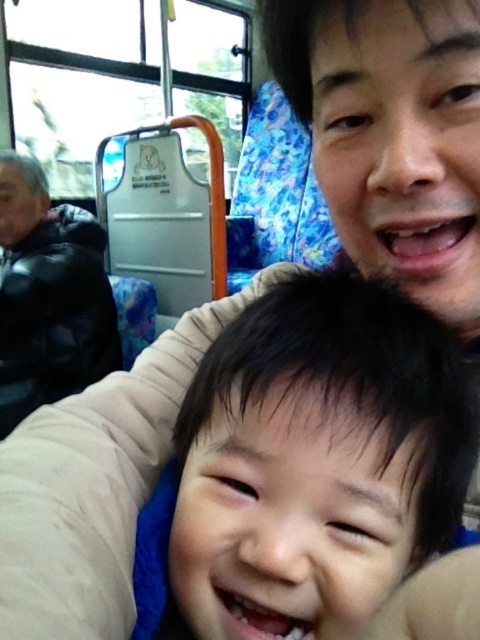
You are a photographer trying to capture the black matte hair at center and the black fuzzy jacket at left in the same frame. Based on their positions, which object should you adjust your camera to focus on first to ensure both are in the shot?

Since the black matte hair at center is to the right of the black fuzzy jacket at left, you should focus on the black fuzzy jacket at left first to ensure both are included in the frame.

You are a passenger on a bus and want to know if the black matte hair at center is above or below the black fuzzy jacket at left. Based on the scene description, what is the relationship between their positions?

The black matte hair at center is located below the black fuzzy jacket at left, so it is positioned underneath it.

Looking at the scene of the adult and child on the bus, where is the black matte hair at center in relation to the smooth skin face at upper right?

The black matte hair at center is to the left of the smooth skin face at upper right.